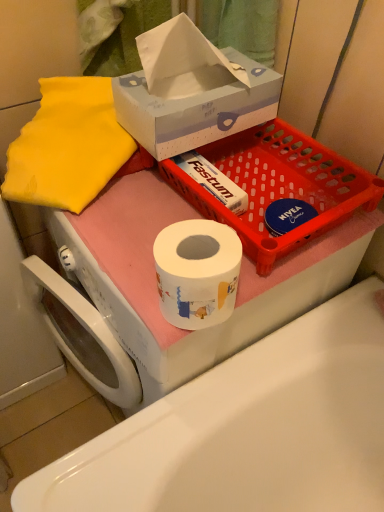
Question: Is matte plastic basket at upper center to the left of white cardboard tissue box at upper center from the viewer's perspective?

Choices:
 (A) no
 (B) yes

Answer: (A)

Question: From the image's perspective, would you say matte plastic basket at upper center is positioned over white cardboard tissue box at upper center?

Choices:
 (A) yes
 (B) no

Answer: (B)

Question: From the image's perspective, does matte plastic basket at upper center appear lower than white cardboard tissue box at upper center?

Choices:
 (A) yes
 (B) no

Answer: (A)

Question: Does matte plastic basket at upper center have a smaller size compared to white cardboard tissue box at upper center?

Choices:
 (A) yes
 (B) no

Answer: (B)

Question: Considering the relative sizes of matte plastic basket at upper center and white cardboard tissue box at upper center in the image provided, is matte plastic basket at upper center bigger than white cardboard tissue box at upper center?

Choices:
 (A) no
 (B) yes

Answer: (B)

Question: Considering their positions, is white cardboard tissue box at upper center located in front of or behind matte plastic basket at upper center?

Choices:
 (A) behind
 (B) front

Answer: (B)

Question: Is point (122, 88) closer or farther from the camera than point (306, 224)?

Choices:
 (A) closer
 (B) farther

Answer: (B)

Question: Looking at the image, does white cardboard tissue box at upper center seem bigger or smaller compared to matte plastic basket at upper center?

Choices:
 (A) small
 (B) big

Answer: (A)

Question: Considering the relative positions of white cardboard tissue box at upper center and matte plastic basket at upper center in the image provided, is white cardboard tissue box at upper center to the left or to the right of matte plastic basket at upper center?

Choices:
 (A) right
 (B) left

Answer: (B)

Question: Is white glossy toilet paper at center wider or thinner than matte plastic basket at upper center?

Choices:
 (A) thin
 (B) wide

Answer: (B)

Question: Choose the correct answer: Is white glossy toilet paper at center inside matte plastic basket at upper center or outside it?

Choices:
 (A) outside
 (B) inside

Answer: (A)

Question: Considering the positions of white glossy toilet paper at center and matte plastic basket at upper center in the image, is white glossy toilet paper at center taller or shorter than matte plastic basket at upper center?

Choices:
 (A) short
 (B) tall

Answer: (B)

Question: From a real-world perspective, is white glossy toilet paper at center positioned above or below matte plastic basket at upper center?

Choices:
 (A) above
 (B) below

Answer: (B)

Question: From the image's perspective, relative to white glossy toilet paper at center, is white cardboard tissue box at upper center above or below?

Choices:
 (A) above
 (B) below

Answer: (A)

Question: From their relative heights in the image, would you say white cardboard tissue box at upper center is taller or shorter than white glossy toilet paper at center?

Choices:
 (A) tall
 (B) short

Answer: (B)